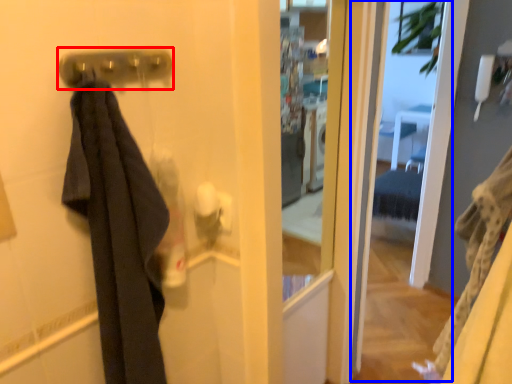
Question: Which point is further to the camera, door handle (highlighted by a red box) or screen door (highlighted by a blue box)?

Choices:
 (A) door handle
 (B) screen door

Answer: (B)